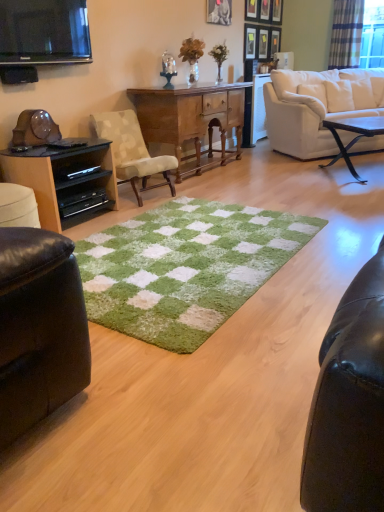
Identify the location of empty space that is ontop of green shaggy rug at center (from a real-world perspective). The image size is (384, 512). (169, 248).